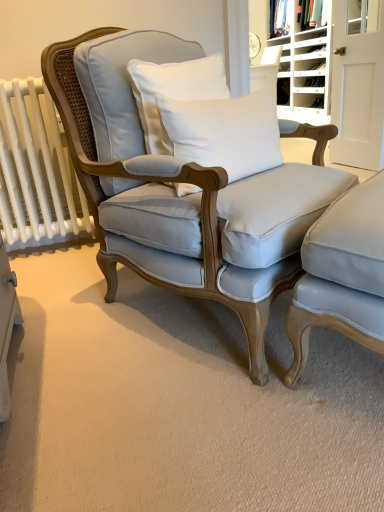
Question: In terms of height, does white cotton pillow at center, the first pillow in the top-to-bottom sequence, look taller or shorter compared to light blue fabric chair at center, the second chair viewed from the right?

Choices:
 (A) tall
 (B) short

Answer: (B)

Question: From the image's perspective, relative to light blue fabric chair at center, which appears as the first chair when viewed from the left, is white cotton pillow at center, the second pillow when ordered from bottom to top, above or below?

Choices:
 (A) below
 (B) above

Answer: (B)

Question: Which object is the closest to the white plastic shoe rack at upper right?

Choices:
 (A) white cotton pillow at center, the second pillow when ordered from bottom to top
 (B) light blue fabric chair at center, which appears as the first chair when viewed from the left
 (C) white cotton pillow at center, the first pillow in the bottom-to-top sequence
 (D) white wood door at upper right
 (E) white wood bookshelf at upper right

Answer: (D)

Question: Which object is the farthest from the white wood door at upper right?

Choices:
 (A) white wood bookshelf at upper right
 (B) white cotton pillow at center, the 2th pillow in the top-to-bottom sequence
 (C) matte white fabric at upper right
 (D) white plastic shoe rack at upper right
 (E) white cotton pillow at center, the first pillow in the top-to-bottom sequence

Answer: (E)